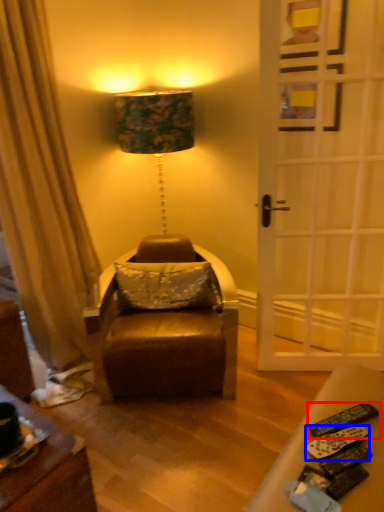
Question: Which of the following is the farthest to the observer, remote control (highlighted by a red box) or remote control (highlighted by a blue box)?

Choices:
 (A) remote control
 (B) remote control

Answer: (A)